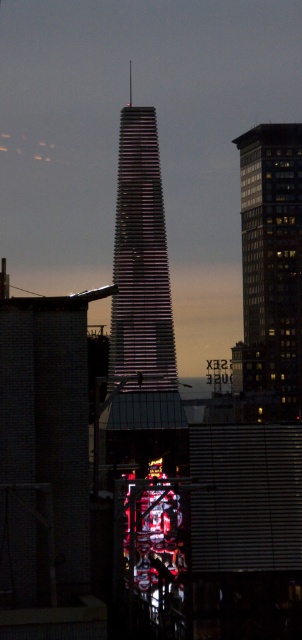
Between glassy reflective skyscraper at right and shiny glass tower at center, which one is positioned lower?

glassy reflective skyscraper at right is lower down.

Does glassy reflective skyscraper at right appear on the right side of shiny glass tower at center?

Indeed, glassy reflective skyscraper at right is positioned on the right side of shiny glass tower at center.

Describe the element at coordinates (272, 262) in the screenshot. This screenshot has width=302, height=640. I see `glassy reflective skyscraper at right` at that location.

Locate an element on the screen. The height and width of the screenshot is (640, 302). glassy reflective skyscraper at right is located at coordinates (272, 262).